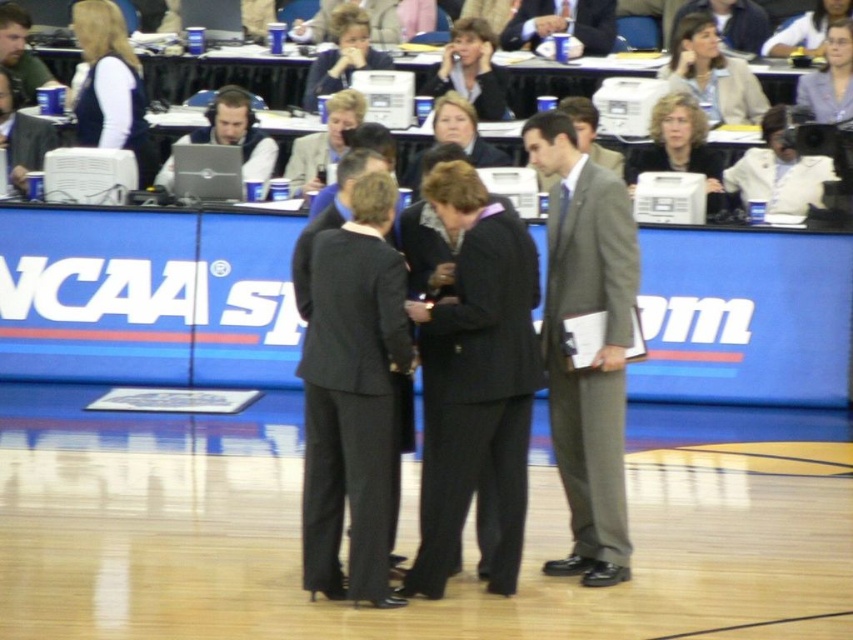
You are an event organizer at the NCAA event and need to arrange name tags for the two central figures wearing black pinstripe suit at center and gray wool suit at center. Which one should you approach first if you want to start from the left side?

The black pinstripe suit at center is positioned on the left side of gray wool suit at center, so you should approach the black pinstripe suit at center first.

Consider the image. You are a photographer positioned at the back of the basketball court. You need to capture a photo of the black pinstripe suit at center and the matte black laptop at upper left. Based on their positions, which object is closer to the camera?

The black pinstripe suit at center is closer to the camera because it is located below the matte black laptop at upper left, meaning it is positioned in front of the laptop in the scene.

You are an event organizer who needs to seat two guests wearing a dark gray suit at center and a black pinstripe suit at center. The chairs available are only 18 inches wide. Can both guests sit comfortably given their suit sizes?

The dark gray suit at center is wider than the black pinstripe suit at center. Since the chairs are only 18 inches wide, the dark gray suit at center may not fit comfortably, but the black pinstripe suit at center might. However, both guests should be offered wider seating options to ensure comfort.